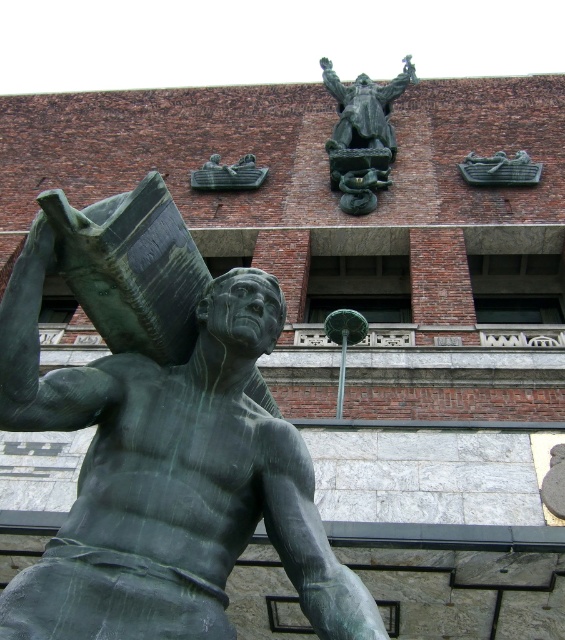
Which of these two, green patina bronze statue at center or green patina book at upper center, stands taller?

green patina bronze statue at center

Between green patina bronze statue at center and green patina book at upper center, which one is positioned higher?

green patina book at upper center is higher up.

At what (x,y) coordinates should I click in order to perform the action: click on green patina bronze statue at center. Please return your answer as a coordinate pair (x, y). The height and width of the screenshot is (640, 565). Looking at the image, I should click on (160, 435).

Is bronze statue at upper center closer to the viewer compared to green patina book at upper center?

Yes, it is in front of green patina book at upper center.

Between point (380, 166) and point (202, 172), which one is positioned in front?

Point (380, 166) is in front.

Does point (354, 186) lie in front of point (202, 168)?

Yes, point (354, 186) is in front of point (202, 168).

Locate an element on the screen. The height and width of the screenshot is (640, 565). bronze statue at upper center is located at coordinates (362, 134).

Can you confirm if green patina bronze statue at center is positioned to the left of bronze statue at upper center?

Correct, you'll find green patina bronze statue at center to the left of bronze statue at upper center.

Is green patina bronze statue at center below bronze statue at upper center?

Indeed, green patina bronze statue at center is positioned under bronze statue at upper center.

Locate an element on the screen. The image size is (565, 640). green patina bronze statue at center is located at coordinates (160, 435).